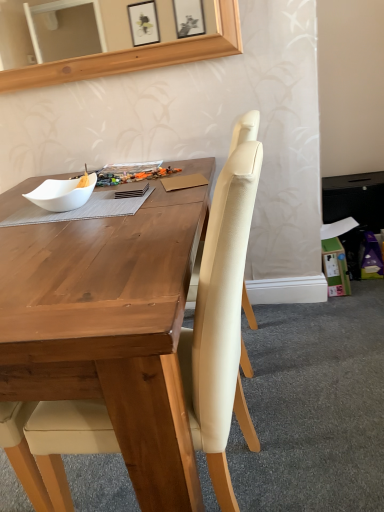
Where is `vacant space to the right of white matte bowl at left`? The height and width of the screenshot is (512, 384). vacant space to the right of white matte bowl at left is located at coordinates (127, 200).